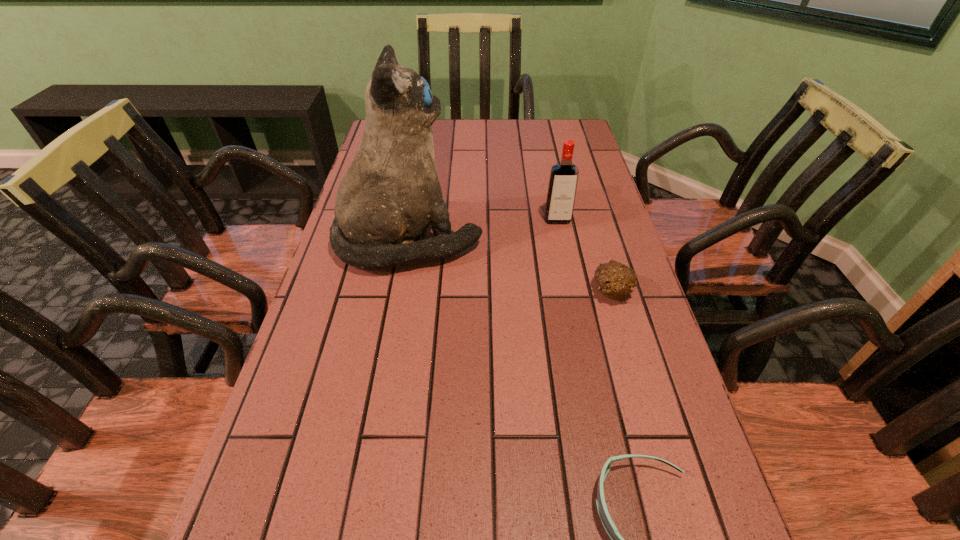
The width and height of the screenshot is (960, 540). What are the coordinates of `the tallest object` in the screenshot? It's located at (390, 194).

At what (x,y) coordinates should I click in order to perform the action: click on cat. Please return your answer as a coordinate pair (x, y). This screenshot has height=540, width=960. Looking at the image, I should click on (390, 194).

The width and height of the screenshot is (960, 540). In order to click on vodka in this screenshot , I will do `click(563, 180)`.

Identify the location of muffin. pyautogui.click(x=615, y=279).

Identify the location of vacant space located at the face of the tallest object. This screenshot has height=540, width=960. (568, 241).

At what (x,y) coordinates should I click in order to perform the action: click on free space located 0.390m on the front and back of the vodka. Please return your answer as a coordinate pair (x, y). The width and height of the screenshot is (960, 540). Looking at the image, I should click on (583, 345).

Identify the location of vacant space located 0.350m on the left of the muffin. Image resolution: width=960 pixels, height=540 pixels. (438, 291).

Image resolution: width=960 pixels, height=540 pixels. Identify the location of object that is at the left edge. (390, 194).

Locate an element on the screen. This screenshot has width=960, height=540. vodka that is at the right edge is located at coordinates (563, 180).

This screenshot has width=960, height=540. Find the location of `muffin at the right edge`. muffin at the right edge is located at coordinates (615, 279).